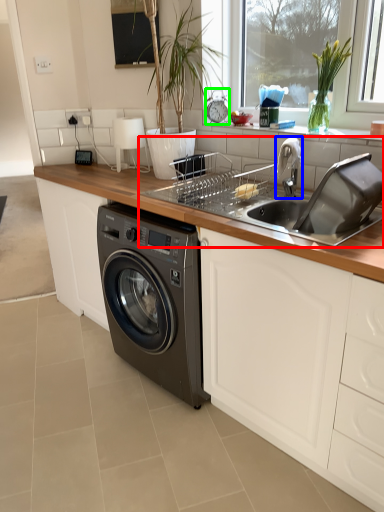
Question: Based on their relative distances, which object is farther from sink (highlighted by a red box)? Choose from faucet (highlighted by a blue box) and appliance (highlighted by a green box).

Choices:
 (A) faucet
 (B) appliance

Answer: (B)